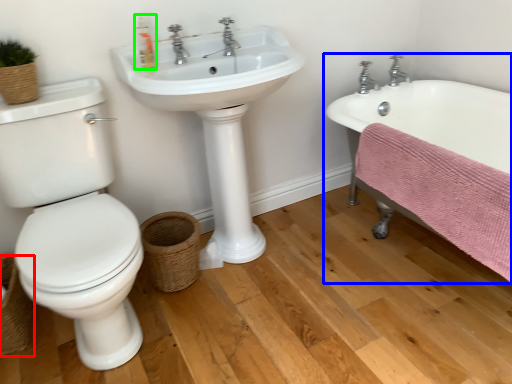
Question: Which is farther away from basket (highlighted by a red box)? bathtub (highlighted by a blue box) or soap dispenser (highlighted by a green box)?

Choices:
 (A) bathtub
 (B) soap dispenser

Answer: (A)